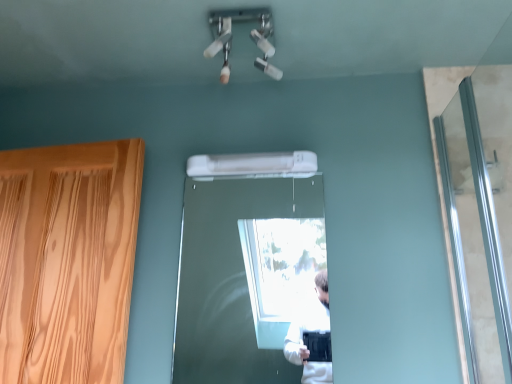
Question: Is silver metallic screen door at right wider or thinner than wooden door at center?

Choices:
 (A) wide
 (B) thin

Answer: (A)

Question: Looking at the image, does silver metallic screen door at right seem bigger or smaller compared to wooden door at center?

Choices:
 (A) small
 (B) big

Answer: (B)

Question: Which is farther from the wooden door at center?

Choices:
 (A) silver metallic screen door at right
 (B) white plastic air conditioner at center

Answer: (A)

Question: Estimate the real-world distances between objects in this image. Which object is closer to the wooden door at center?

Choices:
 (A) silver metallic screen door at right
 (B) white plastic air conditioner at center

Answer: (B)